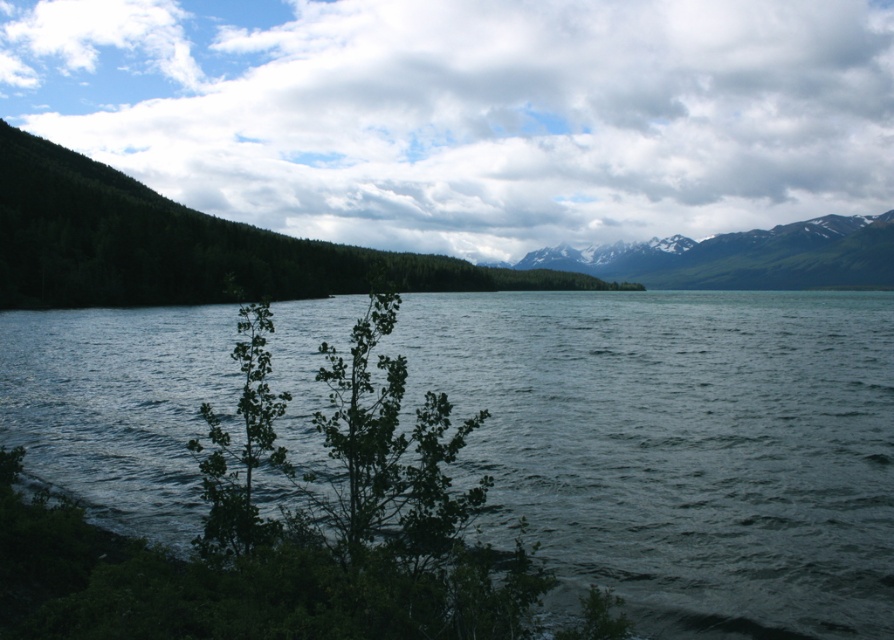
Question: Does white fluffy cloud at upper center appear over green leafy tree at left?

Choices:
 (A) yes
 (B) no

Answer: (A)

Question: Observing the image, what is the correct spatial positioning of white fluffy cloud at upper center in reference to snowy granite mountains at upper right?

Choices:
 (A) right
 (B) left

Answer: (B)

Question: Does white fluffy cloud at upper center lie behind green leafy tree at left?

Choices:
 (A) no
 (B) yes

Answer: (B)

Question: Among these objects, which one is nearest to the camera?

Choices:
 (A) green leafy tree at left
 (B) snowy granite mountains at upper right

Answer: (A)

Question: Which point is closer to the camera taking this photo?

Choices:
 (A) (724, 269)
 (B) (252, 230)
 (C) (589, 198)

Answer: (B)

Question: Among these points, which one is nearest to the camera?

Choices:
 (A) (665, 252)
 (B) (462, 269)

Answer: (B)